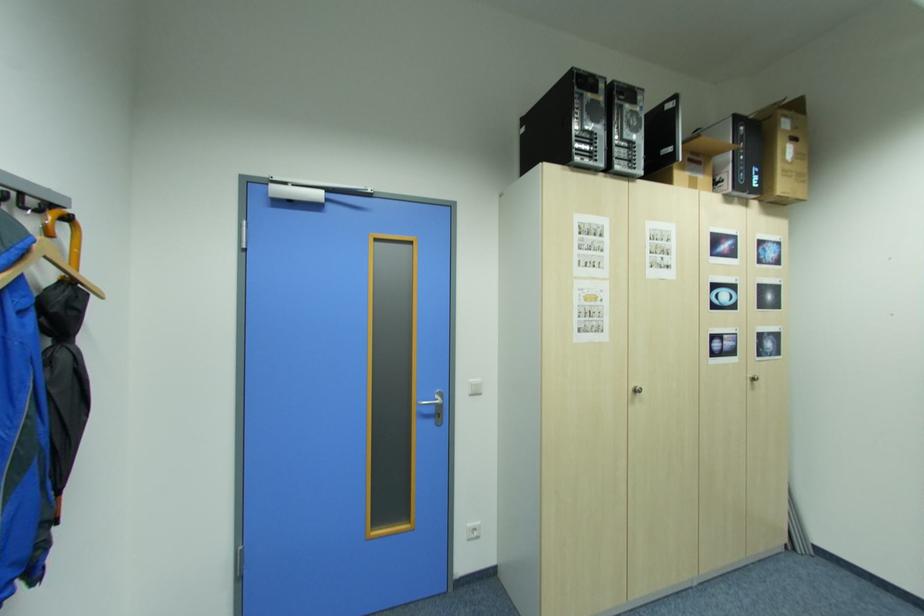
You are a GUI agent. You are given a task and a screenshot of the screen. Output one action in this format:
    pyautogui.click(x=<x>, y=<y>)
    Task: Click on the white light switch
    Image resolution: width=924 pixels, height=616 pixels.
    Given the screenshot: What is the action you would take?
    pyautogui.click(x=472, y=531)